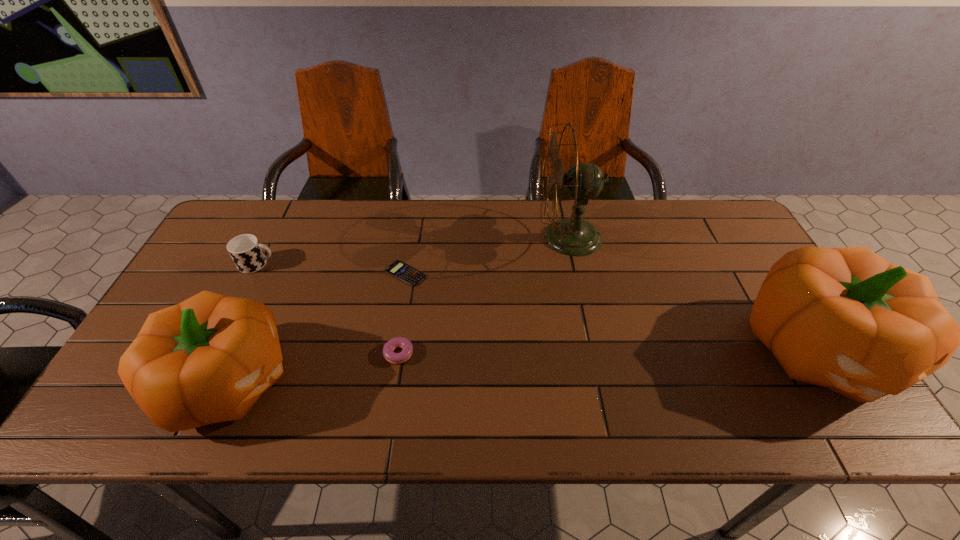
The width and height of the screenshot is (960, 540). Identify the location of object that is at the right edge. (846, 319).

Image resolution: width=960 pixels, height=540 pixels. What are the coordinates of `object present at the near left corner` in the screenshot? It's located at (208, 359).

The image size is (960, 540). What are the coordinates of `object that is at the near right corner` in the screenshot? It's located at (846, 319).

Find the location of a particular element. vacant space at the far edge of the desktop is located at coordinates (336, 217).

In the image, there is a desktop. Identify the location of vacant space at the near edge. The height and width of the screenshot is (540, 960). (498, 364).

The width and height of the screenshot is (960, 540). In order to click on vacant region at the right edge of the desktop in this screenshot , I will do [x=729, y=290].

At what (x,y) coordinates should I click in order to perform the action: click on free location at the far left corner. Please return your answer as a coordinate pair (x, y). Looking at the image, I should click on (266, 213).

Identify the location of free spot between the fourth shortest object and the shortest object. Image resolution: width=960 pixels, height=540 pixels. (318, 327).

What are the coordinates of `vacant region between the rightmost object and the calculator` in the screenshot? It's located at (612, 312).

This screenshot has height=540, width=960. Identify the location of free spot between the shortest object and the left pumpkin. (318, 327).